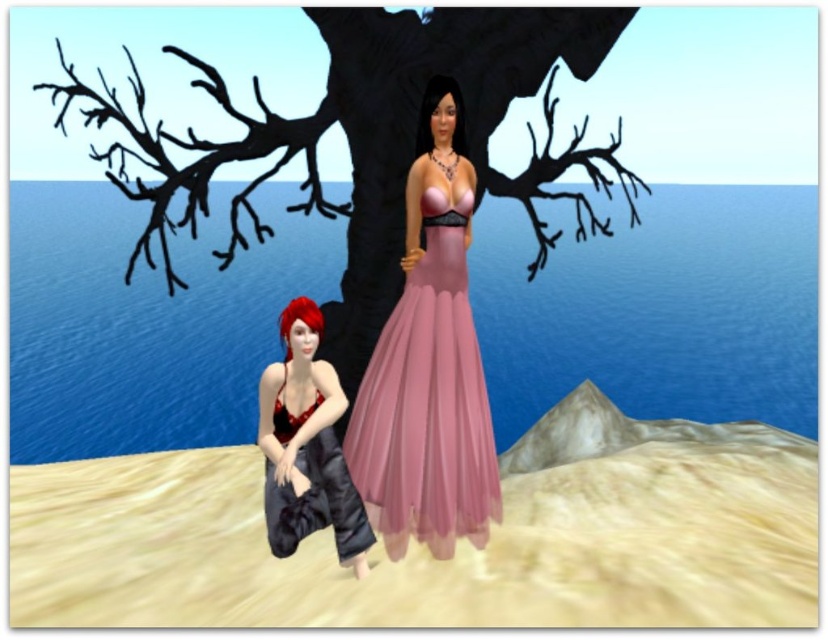
Question: Does pink tulle dress at center lie behind shiny black dress at lower left?

Choices:
 (A) yes
 (B) no

Answer: (A)

Question: Can you confirm if shiny black dress at lower left is positioned to the left of shiny red bikini top at lower left?

Choices:
 (A) no
 (B) yes

Answer: (A)

Question: Estimate the real-world distances between objects in this image. Which object is farther from the shiny red bikini top at lower left?

Choices:
 (A) smooth beige sand at lower center
 (B) black matte tree at upper center
 (C) blue water at center
 (D) shiny black dress at lower left

Answer: (C)

Question: Is smooth beige sand at lower center positioned behind shiny black dress at lower left?

Choices:
 (A) no
 (B) yes

Answer: (A)

Question: Which of the following is the closest to the observer?

Choices:
 (A) black matte tree at upper center
 (B) blue water at center
 (C) shiny red bikini top at lower left

Answer: (C)

Question: Which point is farther to the camera?

Choices:
 (A) black matte tree at upper center
 (B) smooth beige sand at lower center

Answer: (A)